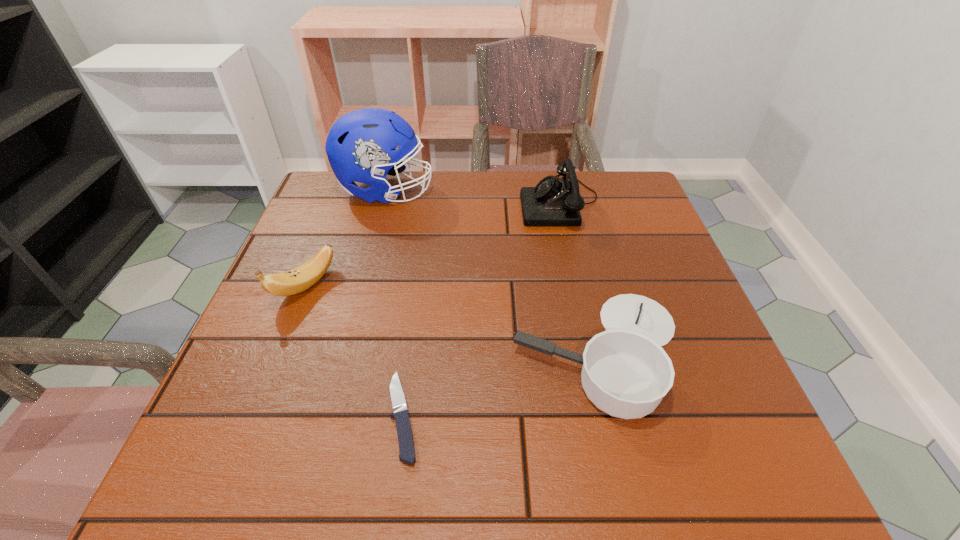
The width and height of the screenshot is (960, 540). Find the location of `vacant space in between the football helmet and the shortest object`. vacant space in between the football helmet and the shortest object is located at coordinates (395, 303).

Identify the location of blank region between the tallest object and the telephone. (472, 197).

Where is `empty space that is in between the telephone and the banana`? empty space that is in between the telephone and the banana is located at coordinates coord(433,244).

Where is `empty location between the telephone and the saucepan`? empty location between the telephone and the saucepan is located at coordinates (580, 276).

Find the location of a particular element. The width and height of the screenshot is (960, 540). vacant space in between the telephone and the banana is located at coordinates (433, 244).

Find the location of a particular element. Image resolution: width=960 pixels, height=540 pixels. vacant area that lies between the shortest object and the football helmet is located at coordinates (395, 303).

What are the coordinates of `free space between the banana and the fourth tallest object` in the screenshot? It's located at (452, 319).

The image size is (960, 540). I want to click on empty location between the telephone and the saucepan, so click(x=580, y=276).

This screenshot has width=960, height=540. In order to click on the fourth closest object to the telephone in this screenshot , I will do `click(405, 438)`.

The width and height of the screenshot is (960, 540). I want to click on object that can be found as the second closest to the saucepan, so click(x=554, y=201).